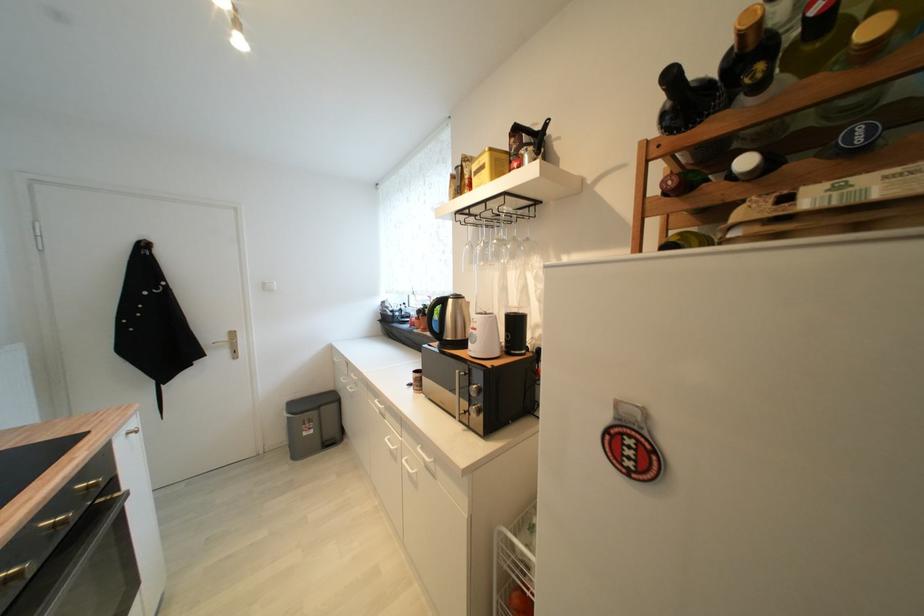
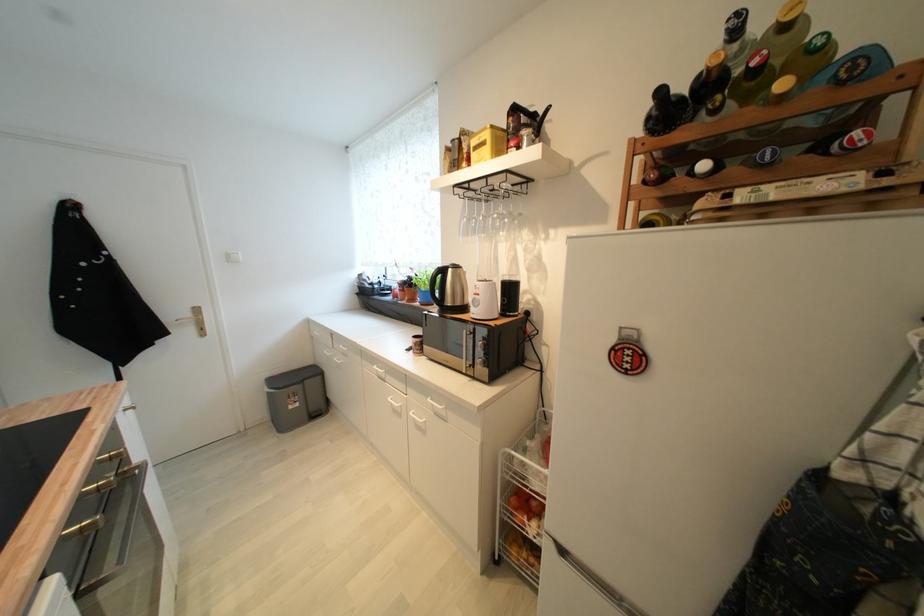
Locate, in the second image, the point that corresponds to (232,354) in the first image.

(197, 331)